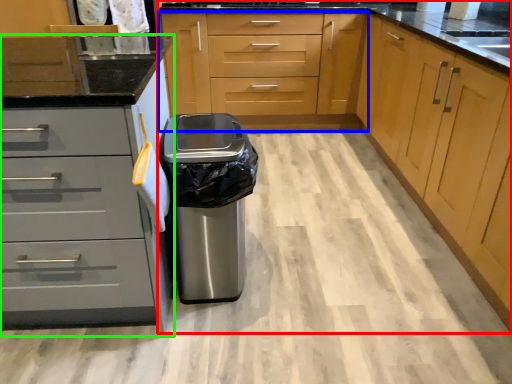
Question: Which object is the farthest from cabinetry (highlighted by a red box)? Choose among these: cabinetry (highlighted by a blue box) or cabinetry (highlighted by a green box).

Choices:
 (A) cabinetry
 (B) cabinetry

Answer: (B)